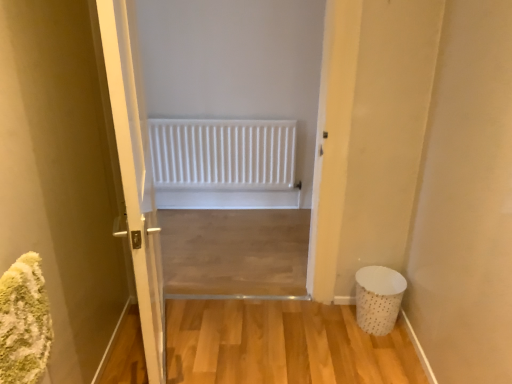
Question: Looking at the image, does white dotted fabric laundry basket at lower right seem bigger or smaller compared to white matte radiator at center?

Choices:
 (A) small
 (B) big

Answer: (A)

Question: From the image's perspective, relative to white matte radiator at center, is white dotted fabric laundry basket at lower right above or below?

Choices:
 (A) above
 (B) below

Answer: (B)

Question: Which object is the closest to the white glossy door at center?

Choices:
 (A) white matte radiator at center
 (B) white dotted fabric laundry basket at lower right

Answer: (B)

Question: Which is nearer to the white glossy door at center?

Choices:
 (A) white dotted fabric laundry basket at lower right
 (B) white matte radiator at center

Answer: (A)